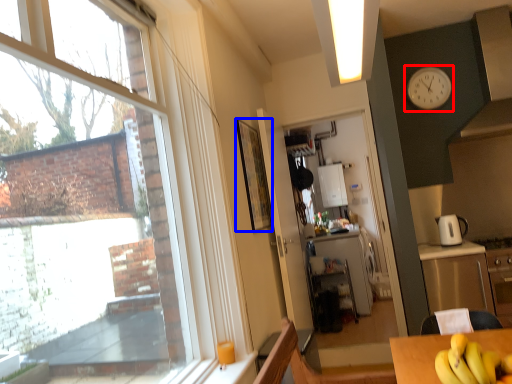
Question: Which object is closer to the camera taking this photo, clock (highlighted by a red box) or picture frame (highlighted by a blue box)?

Choices:
 (A) clock
 (B) picture frame

Answer: (B)